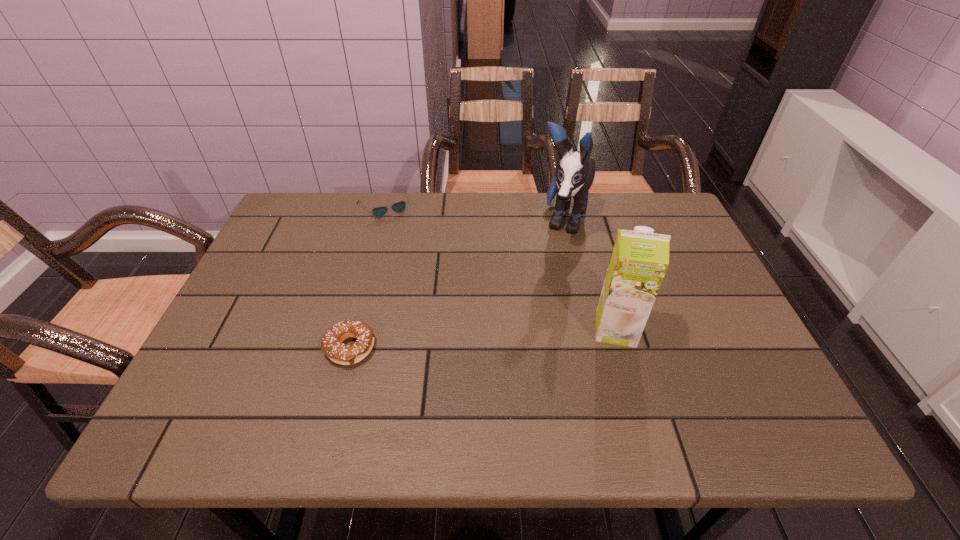
Where is `doughnut`? doughnut is located at coordinates (331, 344).

Where is `the second tallest object`? the second tallest object is located at coordinates (639, 260).

Locate an element on the screen. Image resolution: width=960 pixels, height=540 pixels. puppy is located at coordinates (575, 172).

The image size is (960, 540). I want to click on the shortest object, so click(x=399, y=207).

The height and width of the screenshot is (540, 960). Identify the location of free region located 0.310m on the right of the doughnut. (515, 348).

At what (x,y) coordinates should I click in order to perform the action: click on free location located 0.160m on the back of the second tallest object. Please return your answer as a coordinate pair (x, y). This screenshot has height=540, width=960. Looking at the image, I should click on [x=598, y=267].

At what (x,y) coordinates should I click in order to perform the action: click on vacant area located on the front-facing side of the tallest object. Please return your answer as a coordinate pair (x, y). The width and height of the screenshot is (960, 540). Looking at the image, I should click on (523, 335).

Find the location of a particular element. vacant space situated on the front-facing side of the tallest object is located at coordinates click(528, 323).

This screenshot has width=960, height=540. What are the coordinates of `free space located on the front-facing side of the tallest object` in the screenshot? It's located at (x=516, y=352).

You are a GUI agent. You are given a task and a screenshot of the screen. Output one action in this format:
    pyautogui.click(x=<x>, y=<y>)
    Task: Click on the vacant space situated on the lenses of the shortest object
    The height and width of the screenshot is (540, 960).
    Given the screenshot: What is the action you would take?
    [x=405, y=244]